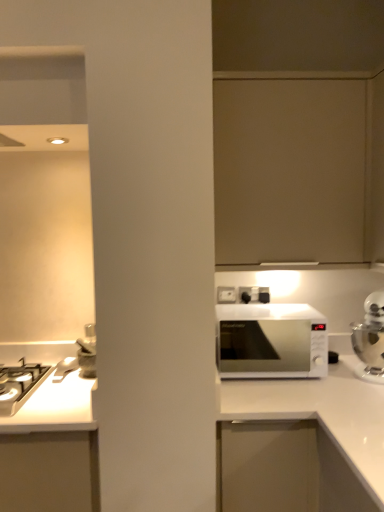
Question: From a real-world perspective, is white plastic electric outlet at upper center positioned above or below white glossy microwave at right?

Choices:
 (A) below
 (B) above

Answer: (B)

Question: Based on their sizes in the image, would you say white plastic electric outlet at upper center is bigger or smaller than white glossy microwave at right?

Choices:
 (A) big
 (B) small

Answer: (B)

Question: Which object is positioned closest to the white glossy gas stove at left?

Choices:
 (A) white glossy microwave at center
 (B) white plastic electric outlet at upper center
 (C) silver metallic kettle at right
 (D) matte beige cabinet at upper center
 (E) white glossy microwave at right

Answer: (B)

Question: Considering the real-world distances, which object is closest to the white glossy gas stove at left?

Choices:
 (A) white plastic electric outlet at upper center
 (B) silver metallic kettle at right
 (C) white glossy microwave at center
 (D) white glossy microwave at right
 (E) matte beige cabinet at upper center

Answer: (A)